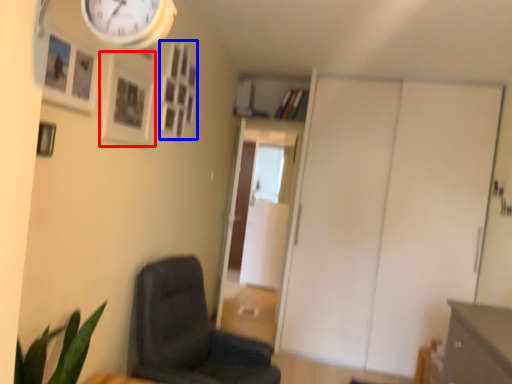
Question: Which object appears farthest to the camera in this image, picture frame (highlighted by a red box) or picture frame (highlighted by a blue box)?

Choices:
 (A) picture frame
 (B) picture frame

Answer: (B)